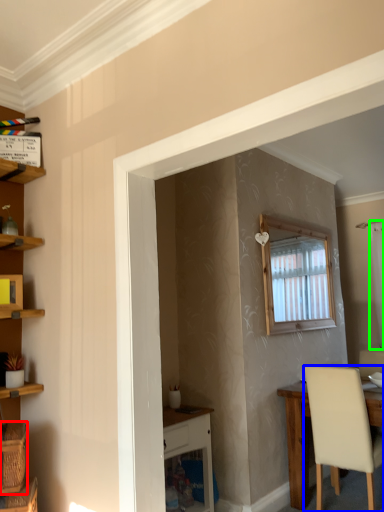
Question: Which object is positioned closest to basket (highlighted by a red box)? Select from chair (highlighted by a blue box) and curtain (highlighted by a green box).

Choices:
 (A) chair
 (B) curtain

Answer: (A)